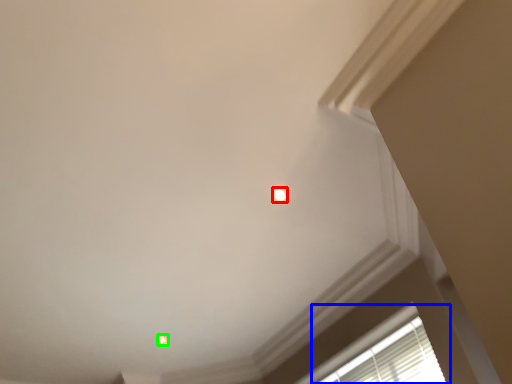
Question: Estimate the real-world distances between objects in this image. Which object is farther from dot (highlighted by a red box), window (highlighted by a blue box) or dot (highlighted by a green box)?

Choices:
 (A) window
 (B) dot

Answer: (B)